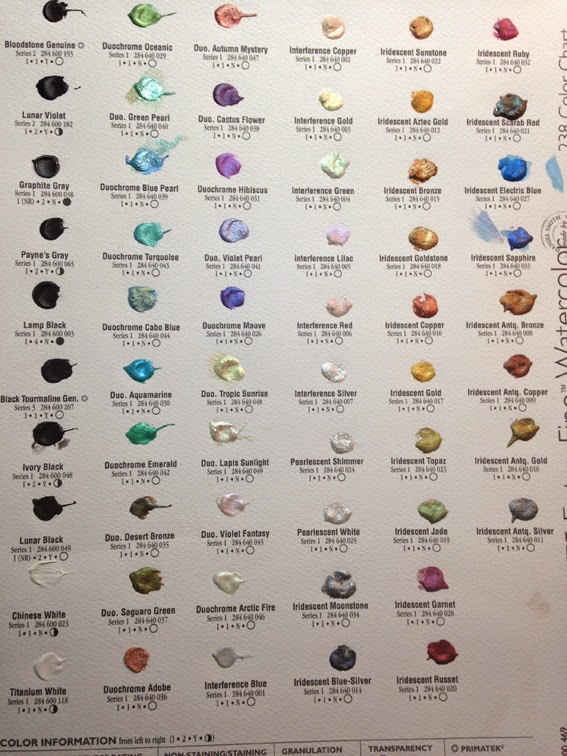
The width and height of the screenshot is (567, 756). Identify the location of paint. (429, 575).